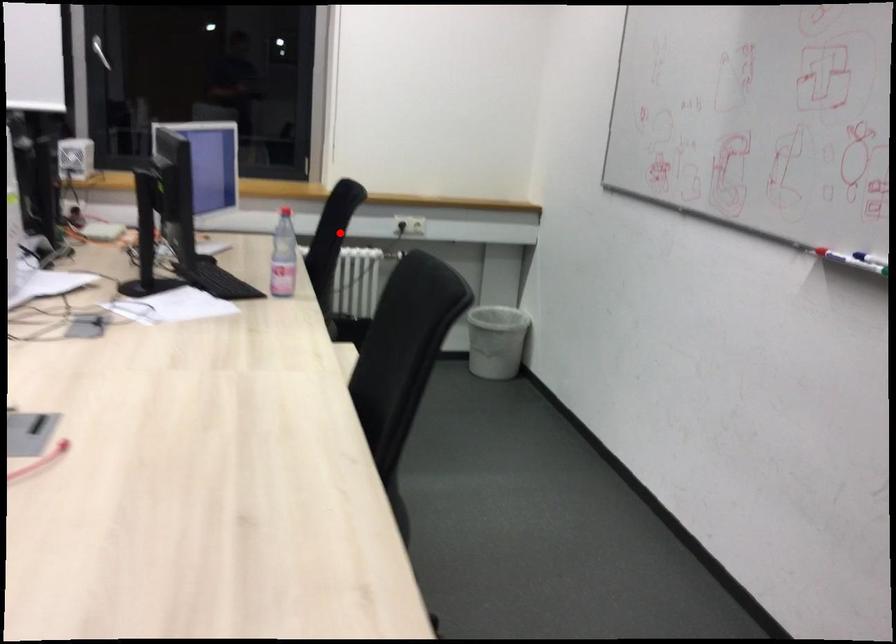
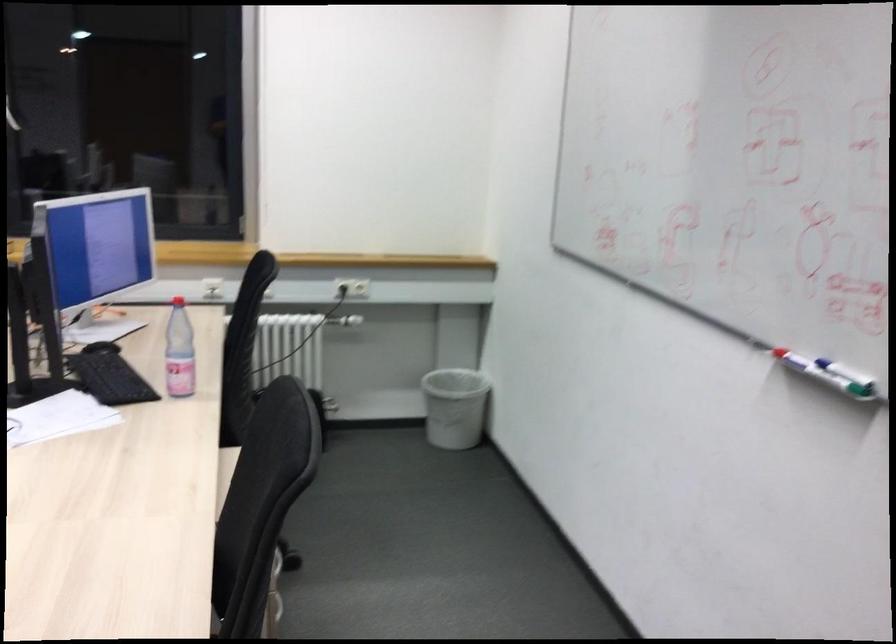
In the second image, find the point that corresponds to the highlighted location in the first image.

(246, 319)